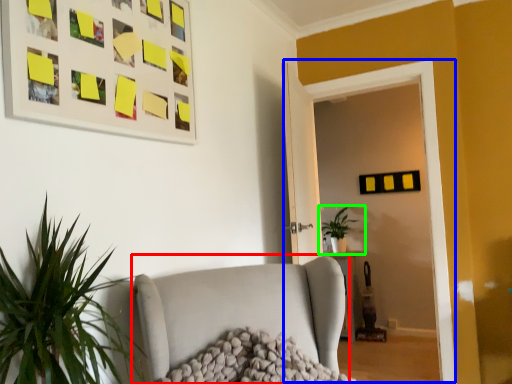
Question: Based on their relative distances, which object is farther from studio couch (highlighted by a red box)? Choose from glass door (highlighted by a blue box) and houseplant (highlighted by a green box).

Choices:
 (A) glass door
 (B) houseplant

Answer: (B)